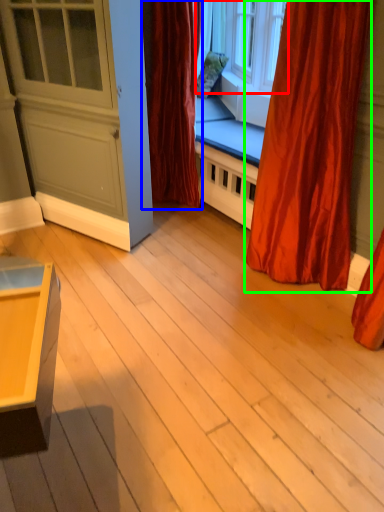
Question: Which object is positioned farthest from window (highlighted by a red box)? Select from curtain (highlighted by a blue box) and curtain (highlighted by a green box).

Choices:
 (A) curtain
 (B) curtain

Answer: (B)